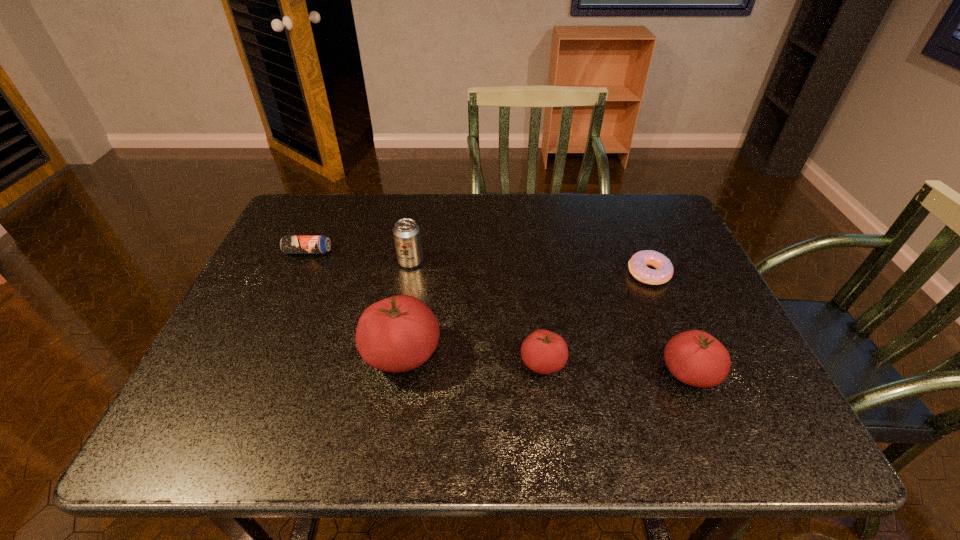
The width and height of the screenshot is (960, 540). I want to click on free space at the near edge, so click(578, 390).

Find the location of a particular element. This screenshot has height=540, width=960. free space at the left edge is located at coordinates (289, 266).

Where is `free location at the far left corner of the desktop`? The width and height of the screenshot is (960, 540). free location at the far left corner of the desktop is located at coordinates (329, 197).

Where is `free region at the near right corner of the desktop`? This screenshot has width=960, height=540. free region at the near right corner of the desktop is located at coordinates (770, 390).

Locate an element on the screen. The width and height of the screenshot is (960, 540). vacant region between the tallest tomato and the left beer can is located at coordinates click(x=355, y=303).

What are the coordinates of `vacant space that is in between the right beer can and the second shortest tomato` in the screenshot? It's located at (550, 318).

Find the location of a particular element. The image size is (960, 540). free space that is in between the shortest tomato and the rightmost tomato is located at coordinates (616, 368).

The height and width of the screenshot is (540, 960). What are the coordinates of `free space that is in between the doughnut and the taller beer can` in the screenshot? It's located at (530, 268).

Locate an element on the screen. This screenshot has height=540, width=960. free point between the third shortest object and the taller beer can is located at coordinates (476, 313).

The width and height of the screenshot is (960, 540). What are the coordinates of `free space between the shortest tomato and the rightmost tomato` in the screenshot? It's located at 616,368.